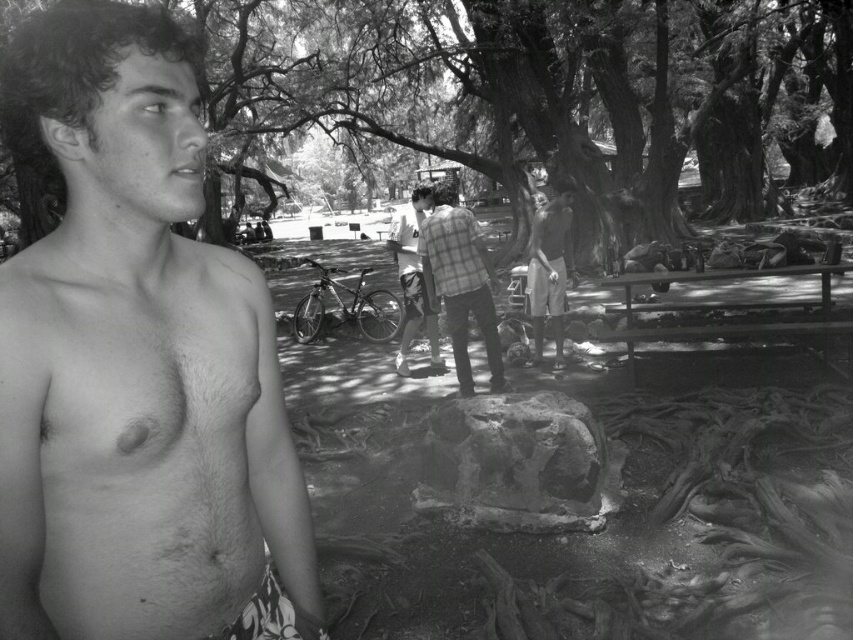
Looking at this image, in the black and white photo, you see two shirts at the center area. The plaid fabric shirt at center and the checkered fabric shirt at center. Which one is positioned to the right?

The plaid fabric shirt at center is positioned to the right of the checkered fabric shirt at center.

You are a photographer trying to capture a closeup shot of both the plaid fabric shirt at center and the checkered fabric shirt at center. Given that your camera has a maximum focus range of 24 inches, will you be able to fit both shirts into the frame without moving the camera?

The plaid fabric shirt at center and checkered fabric shirt at center are 24.50 inches apart from each other. Since the distance between them exceeds the camera maximum focus range of 24 inches, you cannot fit both shirts into the frame without moving the camera.

In the black and white photo, where is the plaid fabric shirt at center located in terms of coordinates?

The plaid fabric shirt at center is located at coordinates point (459, 282).